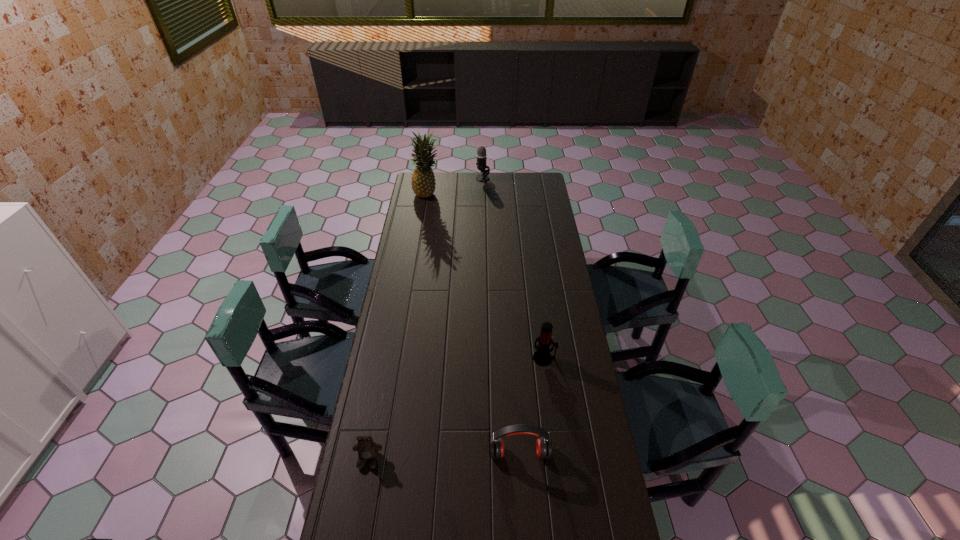
Where is `free spot at the right edge of the desktop`? The image size is (960, 540). free spot at the right edge of the desktop is located at coordinates (533, 256).

This screenshot has width=960, height=540. I want to click on unoccupied position between the fourth nearest object and the earphone, so click(473, 323).

Find the location of a particular element. This screenshot has width=960, height=540. unoccupied area between the fourth nearest object and the earphone is located at coordinates (x=473, y=323).

Find the location of a particular element. This screenshot has width=960, height=540. free space between the nearer microphone and the earphone is located at coordinates (532, 406).

Where is `vacant area between the left microphone and the right microphone`? vacant area between the left microphone and the right microphone is located at coordinates click(514, 268).

I want to click on empty space between the earphone and the farthest object, so click(501, 315).

What are the coordinates of `unoccupied position between the earphone and the shortest object` in the screenshot? It's located at (444, 456).

Where is `vacant point located between the pineapple and the right microphone`? vacant point located between the pineapple and the right microphone is located at coordinates (486, 276).

Identify which object is located as the fourth nearest to the earphone. Please provide its 2D coordinates. Your answer should be formatted as a tuple, i.e. [(x, y)], where the tuple contains the x and y coordinates of a point satisfying the conditions above.

[(481, 151)]

Point out which object is positioned as the nearest to the right microphone. Please provide its 2D coordinates. Your answer should be formatted as a tuple, i.e. [(x, y)], where the tuple contains the x and y coordinates of a point satisfying the conditions above.

[(543, 445)]